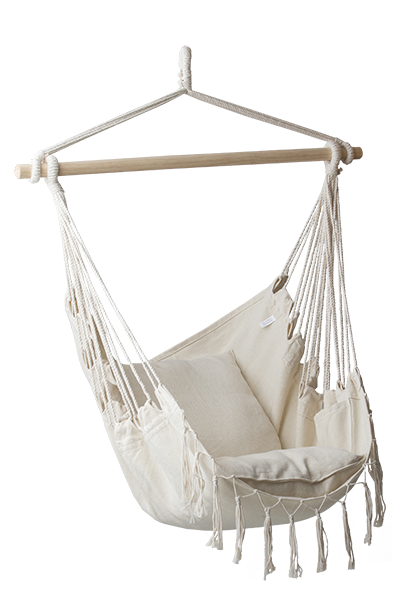
Find the location of a particular element. This screenshot has height=600, width=400. hammock seat back cushion is located at coordinates (227, 420).